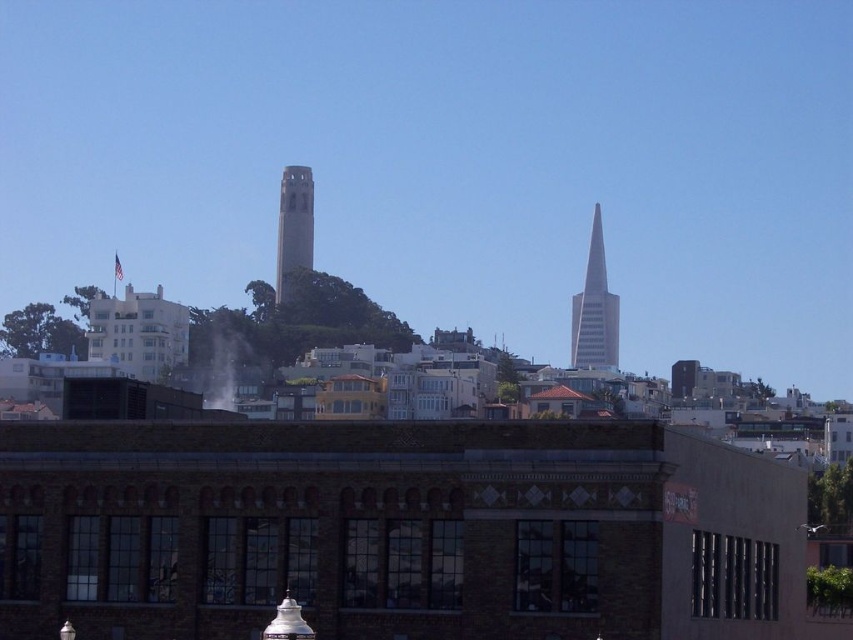
Between silver glass spire at center right and concrete tower at center, which one appears on the left side from the viewer's perspective?

From the viewer's perspective, concrete tower at center appears more on the left side.

The width and height of the screenshot is (853, 640). Find the location of `silver glass spire at center right`. silver glass spire at center right is located at coordinates (595, 310).

Between point (595, 364) and point (289, 204), which one is positioned behind?

The point (595, 364) is more distant.

This screenshot has width=853, height=640. I want to click on silver glass spire at center right, so click(x=595, y=310).